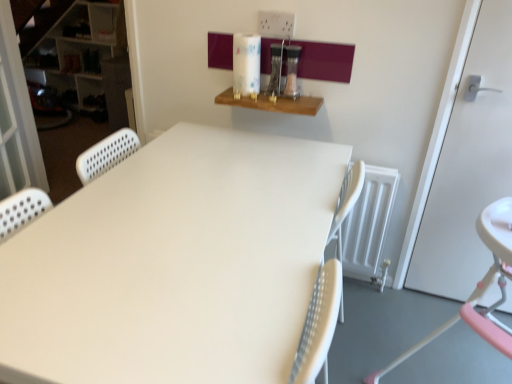
Question: From the image's perspective, is white matte table at center above or below pink plastic highchair at lower right?

Choices:
 (A) below
 (B) above

Answer: (A)

Question: Looking at their shapes, would you say white matte table at center is wider or thinner than pink plastic highchair at lower right?

Choices:
 (A) wide
 (B) thin

Answer: (B)

Question: Which object is positioned closest to the white matte door at right?

Choices:
 (A) pink plastic highchair at lower right
 (B) white perforated screen door at left
 (C) white plastic bookshelf at left
 (D) white matte table at center
 (E) wooden shelf at upper center

Answer: (A)

Question: Based on their relative distances, which object is nearer to the white matte table at center?

Choices:
 (A) white matte door at right
 (B) wooden shelf at upper center
 (C) white plastic bookshelf at left
 (D) pink plastic highchair at lower right
 (E) white perforated screen door at left

Answer: (B)